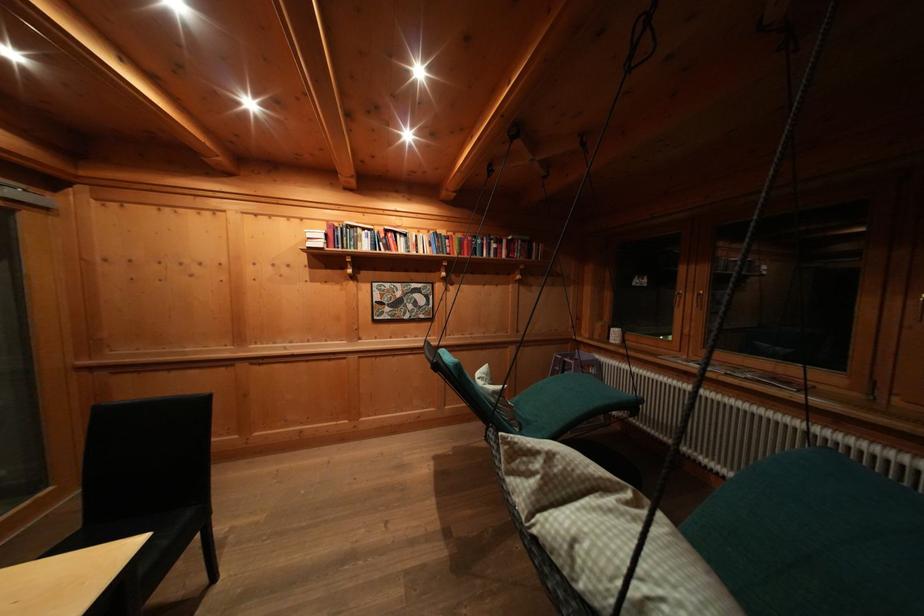
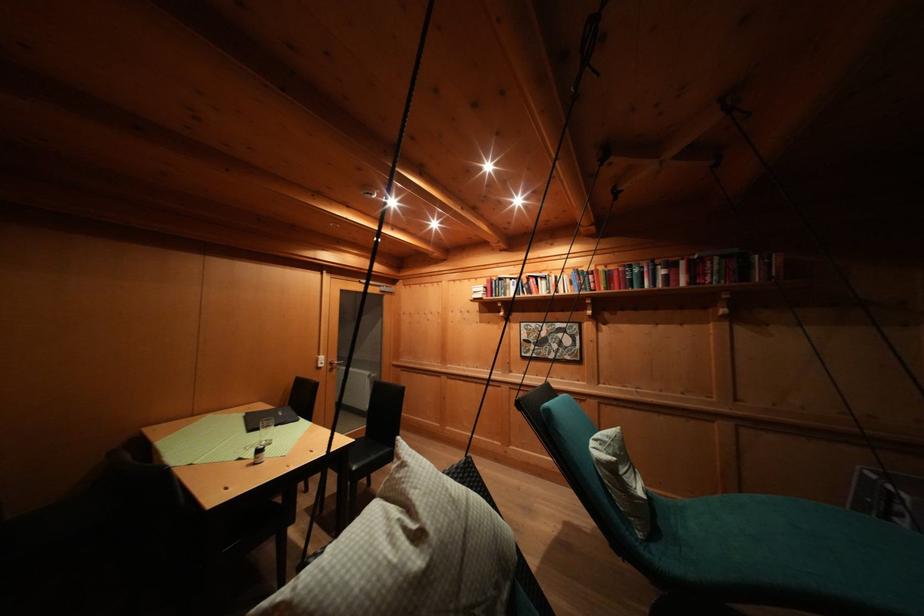
In the second image, find the point that corresponds to (x=365, y=235) in the first image.

(514, 285)